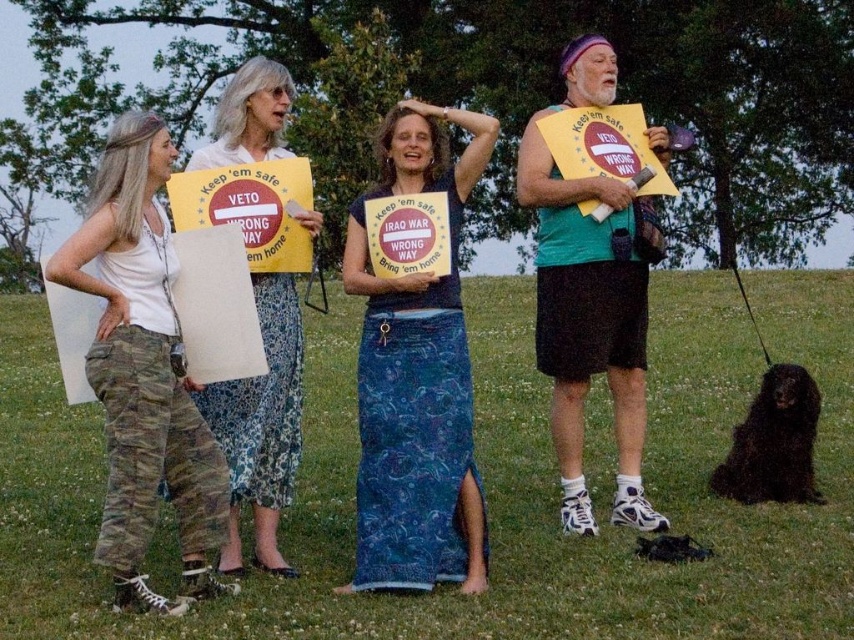
You are a photographer taking a picture of the protest scene. You want to ensure both the camouflage pants at left and the floral skirt at center are clearly visible in your shot. Which object should you focus on first to ensure both are in frame?

The camouflage pants at left is located below the floral skirt at center, so you should focus on the floral skirt at center first to ensure both are in frame.

You are a photographer trying to capture a photo of the blue denim skirt at center and camouflage pants at left. The camera you are using has a minimum focus distance of 4 feet. Will you be able to focus on both subjects clearly without moving the camera?

The distance between the blue denim skirt at center and camouflage pants at left is 4.05 feet. Since the camera requires a minimum focus distance of 4 feet, the subjects are just beyond the required distance. Therefore, you can focus on both subjects clearly without moving the camera.

You are a photographer trying to capture both the blue denim skirt at center and the floral skirt at center in a single shot. Which skirt should you focus on first to ensure both are in frame?

You should focus on the blue denim skirt at center first because it is closer to the viewer than the floral skirt at center, allowing you to adjust the camera to include both in the frame.